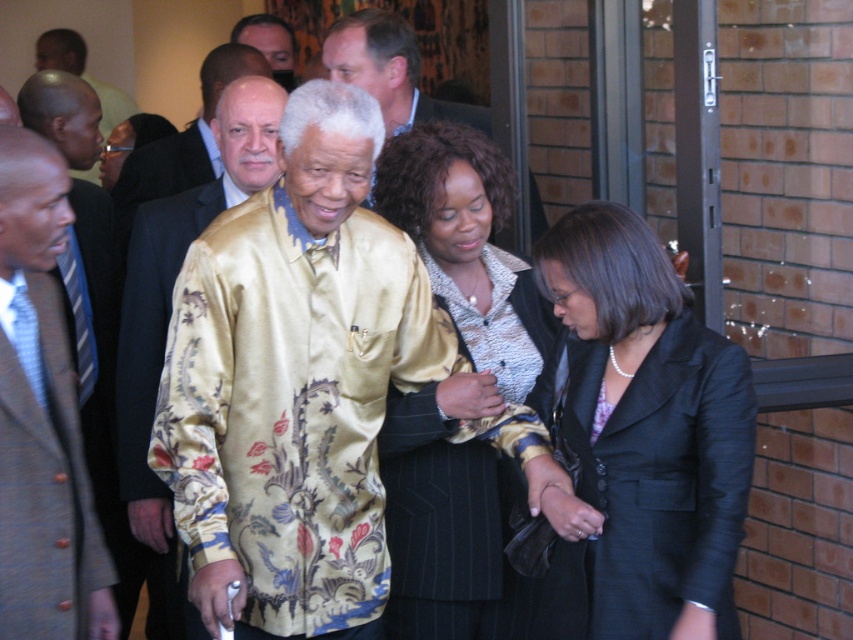
You are organizing a photo shoot and need to ensure that all clothing items in the image are appropriately sized for their respective models. Given that the silky yellow shirt at center and the black pinstripe suit at center are both part of the outfits, which clothing item is larger in size?

The silky yellow shirt at center is larger than the black pinstripe suit at center.